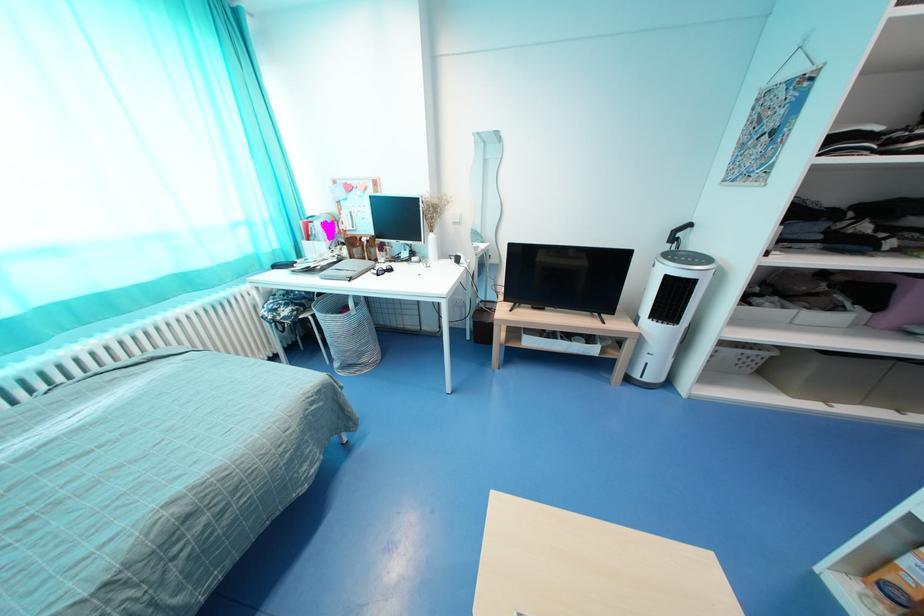
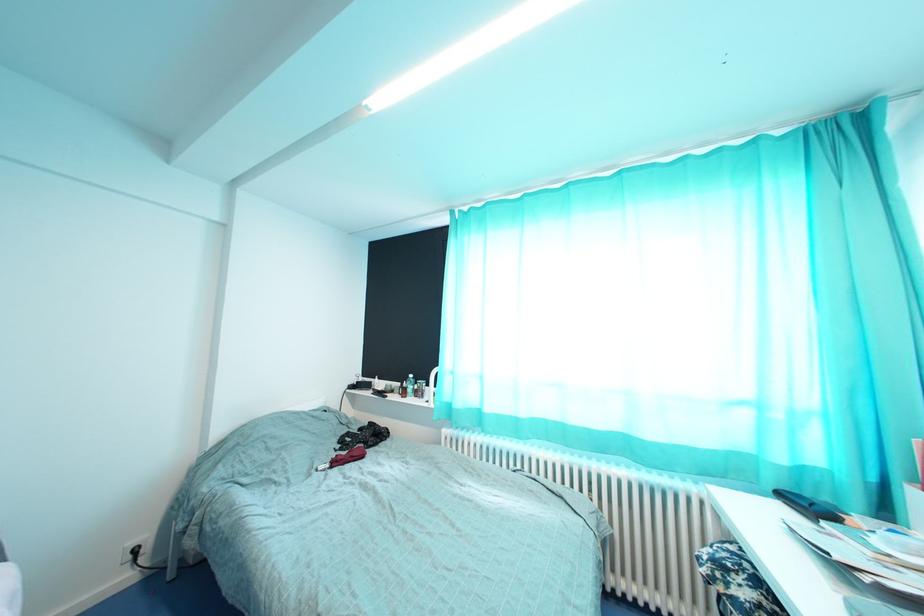
Question: The camera is either moving clockwise (left) or counter-clockwise (right) around the object. The first image is from the beginning of the video and the second image is from the end. Is the camera moving left or right when shooting the video?

Choices:
 (A) Left
 (B) Right

Answer: (B)